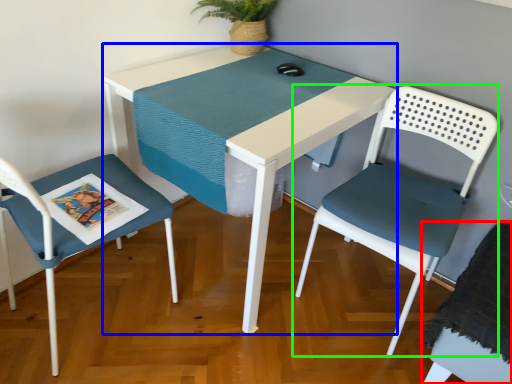
Question: Estimate the real-world distances between objects in this image. Which object is farther from chair (highlighted by a red box), table (highlighted by a blue box) or chair (highlighted by a green box)?

Choices:
 (A) table
 (B) chair

Answer: (A)